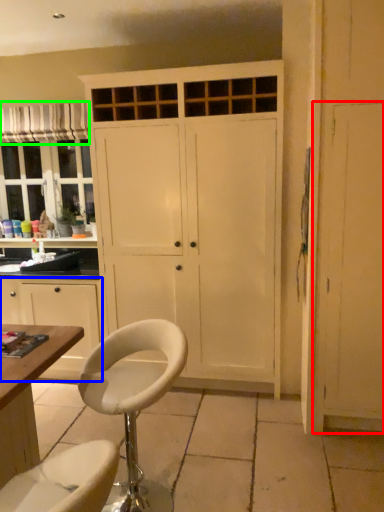
Question: Considering the real-world distances, which object is farthest from screen door (highlighted by a red box)? cabinetry (highlighted by a blue box) or curtain (highlighted by a green box)?

Choices:
 (A) cabinetry
 (B) curtain

Answer: (B)